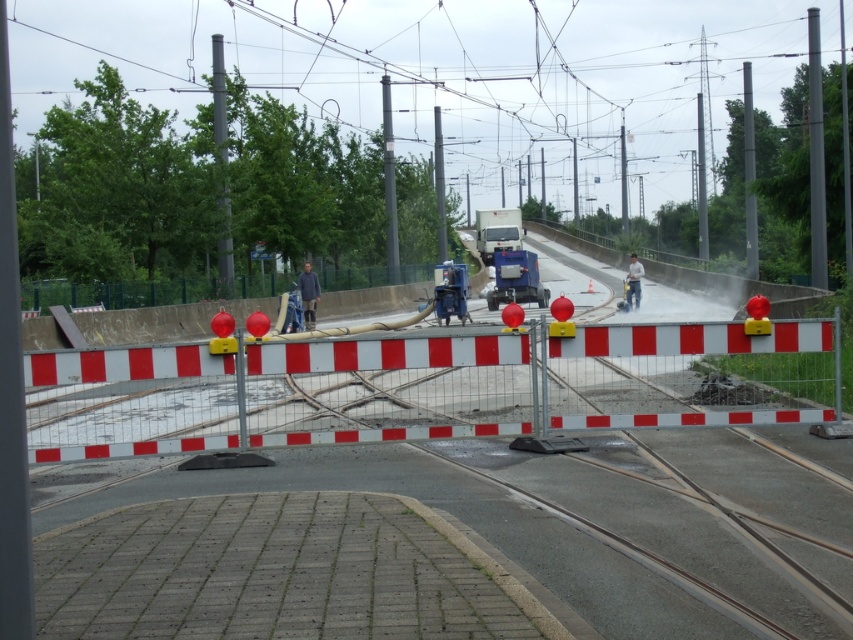
Question: Does metallic silver barricade at center appear on the right side of blue metallic machine at center?

Choices:
 (A) no
 (B) yes

Answer: (A)

Question: Which object appears farthest from the camera in this image?

Choices:
 (A) metallic silver barricade at center
 (B) blue metallic machine at center

Answer: (B)

Question: In this image, where is metallic silver barricade at center located relative to blue metallic machine at center?

Choices:
 (A) above
 (B) below

Answer: (B)

Question: Is metallic silver barricade at center smaller than blue metallic machine at center?

Choices:
 (A) no
 (B) yes

Answer: (A)